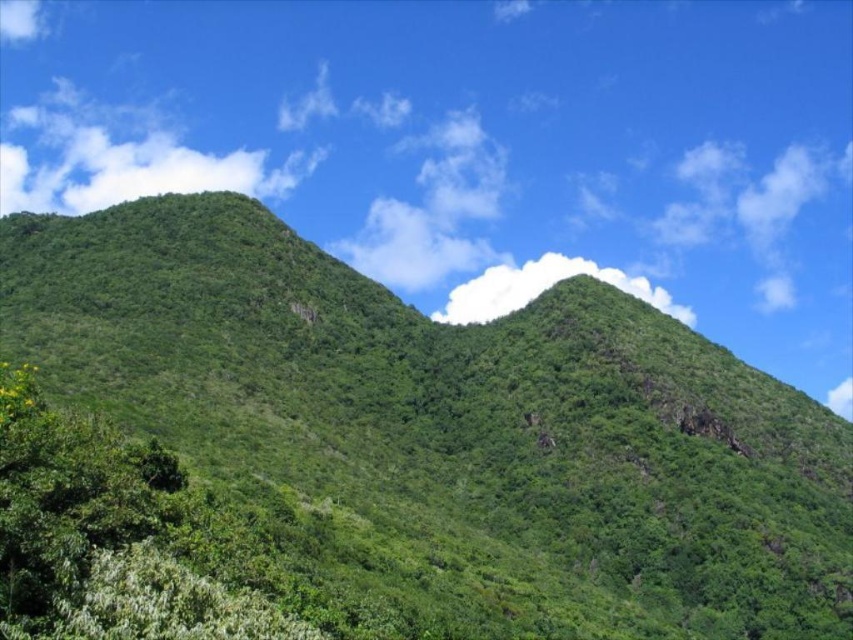
Between white fluffy cloud at upper left and white fluffy cloud at upper center, which one appears on the left side from the viewer's perspective?

white fluffy cloud at upper left is more to the left.

Between white fluffy cloud at upper left and white fluffy cloud at upper center, which one is positioned higher?

white fluffy cloud at upper left is above.

The height and width of the screenshot is (640, 853). Find the location of `white fluffy cloud at upper left`. white fluffy cloud at upper left is located at coordinates (120, 163).

You are a GUI agent. You are given a task and a screenshot of the screen. Output one action in this format:
    pyautogui.click(x=<x>, y=<y>)
    Task: Click on the green leafy hillside at center
    The image size is (853, 640).
    Given the screenshot: What is the action you would take?
    (x=450, y=428)

Consider the image. Can you confirm if green leafy hillside at center is positioned to the right of white fluffy cloud at upper center?

No, green leafy hillside at center is not to the right of white fluffy cloud at upper center.

Is point (521, 600) closer to camera compared to point (653, 289)?

That is True.

Locate an element on the screen. This screenshot has width=853, height=640. green leafy hillside at center is located at coordinates (450, 428).

Locate an element on the screen. The height and width of the screenshot is (640, 853). green leafy hillside at center is located at coordinates (450, 428).

Is point (712, 445) behind point (100, 564)?

Yes.

Identify the location of green leafy hillside at center. (450, 428).